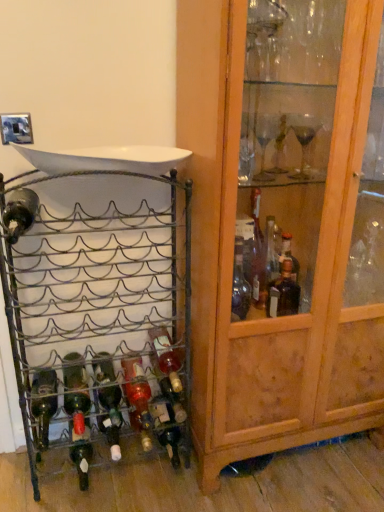
Question: Considering the relative sizes of metallic wire wine rack at left and green glass bottle at center, arranged as the third bottle when viewed from the right, in the image provided, is metallic wire wine rack at left shorter than green glass bottle at center, arranged as the third bottle when viewed from the right,?

Choices:
 (A) no
 (B) yes

Answer: (A)

Question: Is metallic wire wine rack at left in front of green glass bottle at center, arranged as the third bottle when viewed from the right?

Choices:
 (A) yes
 (B) no

Answer: (A)

Question: From the image's perspective, is metallic wire wine rack at left under green glass bottle at center, arranged as the third bottle when viewed from the right?

Choices:
 (A) no
 (B) yes

Answer: (A)

Question: Is metallic wire wine rack at left turned away from green glass bottle at center, marked as the fourth bottle in a left-to-right arrangement?

Choices:
 (A) no
 (B) yes

Answer: (B)

Question: Is green glass bottle at center, marked as the fourth bottle in a left-to-right arrangement, located within metallic wire wine rack at left?

Choices:
 (A) yes
 (B) no

Answer: (A)

Question: Visually, is green glass bottle at lower left, which is the second bottle from left to right, positioned to the left or to the right of translucent glass bottle at center, placed as the first bottle when sorted from right to left?

Choices:
 (A) left
 (B) right

Answer: (A)

Question: From a real-world perspective, relative to translucent glass bottle at center, arranged as the 6th bottle when viewed from the left, is green glass bottle at lower left, the 5th bottle when ordered from right to left, vertically above or below?

Choices:
 (A) below
 (B) above

Answer: (A)

Question: In the image, is green glass bottle at lower left, the 5th bottle when ordered from right to left, positioned in front of or behind translucent glass bottle at center, arranged as the 6th bottle when viewed from the left?

Choices:
 (A) behind
 (B) front

Answer: (B)

Question: Looking at their shapes, would you say green glass bottle at lower left, which is the second bottle from left to right, is wider or thinner than translucent glass bottle at center, placed as the first bottle when sorted from right to left?

Choices:
 (A) wide
 (B) thin

Answer: (A)

Question: From the image's perspective, is translucent glass bottle at center, the second bottle in the right-to-left sequence, above or below green glass bottle at lower left, which is the second bottle from left to right?

Choices:
 (A) above
 (B) below

Answer: (B)

Question: From a real-world perspective, is translucent glass bottle at center, the second bottle in the right-to-left sequence, physically located above or below green glass bottle at lower left, the 5th bottle when ordered from right to left?

Choices:
 (A) below
 (B) above

Answer: (A)

Question: Would you say translucent glass bottle at center, the fifth bottle when ordered from left to right, is to the left or to the right of green glass bottle at lower left, the 5th bottle when ordered from right to left, in the picture?

Choices:
 (A) right
 (B) left

Answer: (A)

Question: From their relative heights in the image, would you say translucent glass bottle at center, the second bottle in the right-to-left sequence, is taller or shorter than green glass bottle at lower left, the 5th bottle when ordered from right to left?

Choices:
 (A) tall
 (B) short

Answer: (A)

Question: Is green glass bottle at lower left, the 5th bottle when ordered from right to left, to the left or to the right of wooden cabinet at right in the image?

Choices:
 (A) left
 (B) right

Answer: (A)

Question: Looking at their shapes, would you say green glass bottle at lower left, which is the second bottle from left to right, is wider or thinner than wooden cabinet at right?

Choices:
 (A) wide
 (B) thin

Answer: (B)